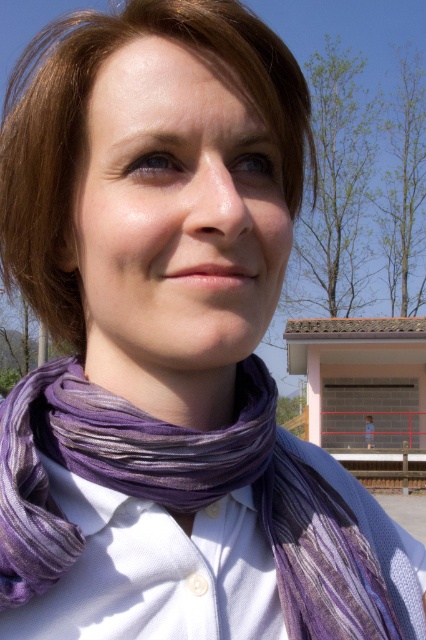
You are trying to decide which scarf to wear for a casual day out. Both the purple striped scarf at center and the purple woven scarf at center are in front of you. Based on their appearance in the image, which one would you choose if you want a wider option?

The purple striped scarf at center might be wider than purple woven scarf at center, so you should choose the purple striped scarf at center for a wider option.

You are an architect designing a new building. You need to place a purple fabric at center in the image. Where should you place it in terms of coordinates?

The purple fabric at center should be placed at coordinates (164,360) as per the 2D location provided.

You are a photographer trying to capture the scene. You notice the brownhair at upper left and the purple fabric at center. Which object should you adjust your camera focus to first if you want to ensure both are in frame, considering their sizes?

You should focus on the brownhair at upper left first because it is wider than the purple fabric at center, so it requires more attention to fit properly in the frame.